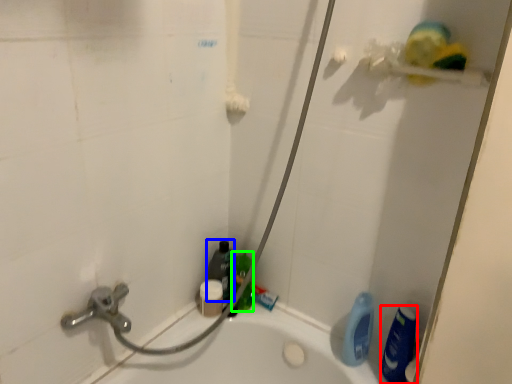
Question: Which object is the closest to the cleaning product (highlighted by a red box)? Choose among these: cleaning product (highlighted by a blue box) or cleaning product (highlighted by a green box).

Choices:
 (A) cleaning product
 (B) cleaning product

Answer: (B)